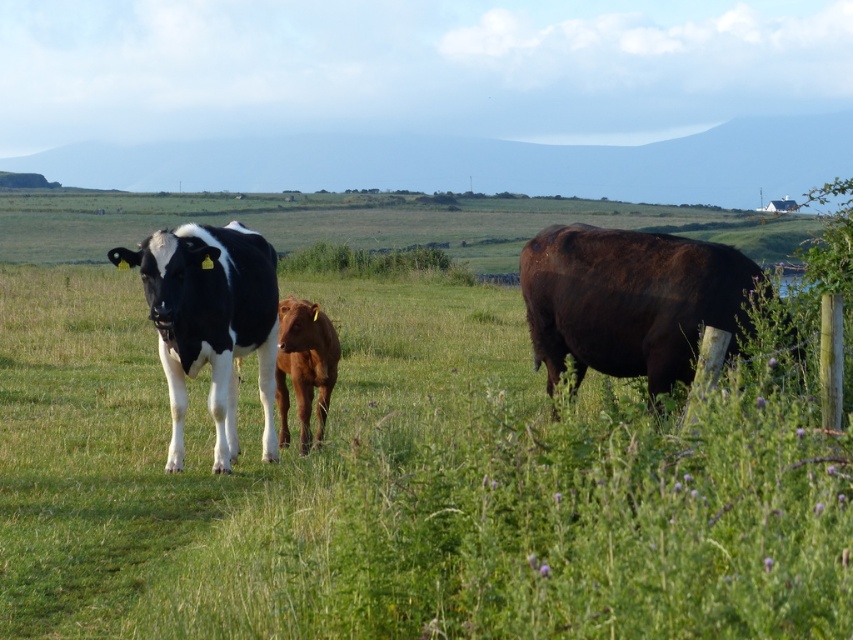
You are a farmer who wants to separate the shiny dark brown bull at right from the brown smooth calf at center. Which direction should you move the calf to ensure it is no longer next to the bull?

The shiny dark brown bull at right is to the right of the brown smooth calf at center. To separate them, move the calf to the left so it is no longer adjacent to the bull.